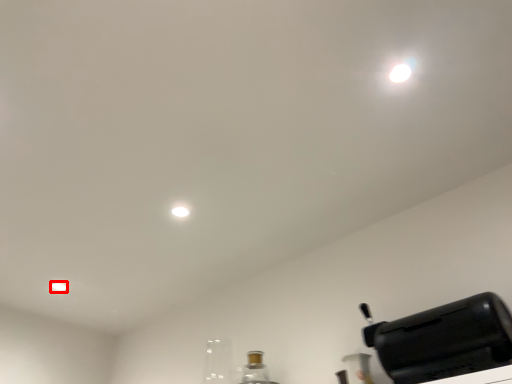
Question: Where is dot (annotated by the red box) located in relation to home appliance in the image?

Choices:
 (A) left
 (B) right

Answer: (A)